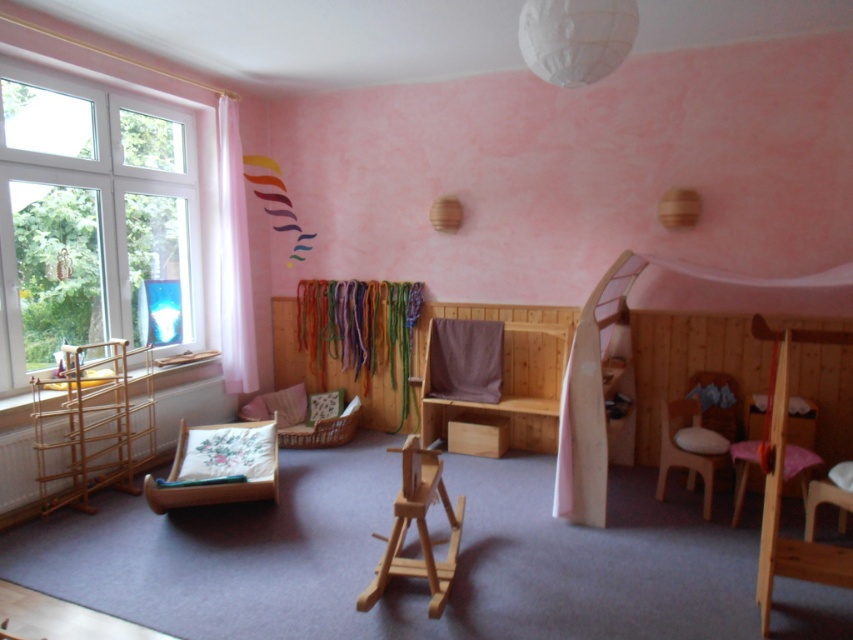
In the scene shown: Who is higher up, white sheer curtain at left or wooden armchair at center?

white sheer curtain at left is higher up.

Can you confirm if white sheer curtain at left is thinner than wooden armchair at center?

Indeed, white sheer curtain at left has a lesser width compared to wooden armchair at center.

Which is in front, point (236, 250) or point (430, 564)?

Point (430, 564) is in front.

Find the location of `white sheer curtain at left`. white sheer curtain at left is located at coordinates (234, 259).

Who is lower down, wooden bunk bed at center or white sheer curtain at left?

wooden bunk bed at center is below.

Is wooden bunk bed at center positioned before white sheer curtain at left?

Yes, it is in front of white sheer curtain at left.

Is point (616, 300) positioned after point (221, 115)?

No, it is not.

Identify the location of wooden bunk bed at center. The image size is (853, 640). (602, 385).

Does point (64, 339) lie in front of point (457, 499)?

That is False.

Is point (183, 161) positioned after point (442, 600)?

Yes, it is.

Does point (10, 321) lie in front of point (418, 572)?

No, it is behind (418, 572).

This screenshot has height=640, width=853. In order to click on white plastic window at left in this screenshot , I will do `click(91, 218)`.